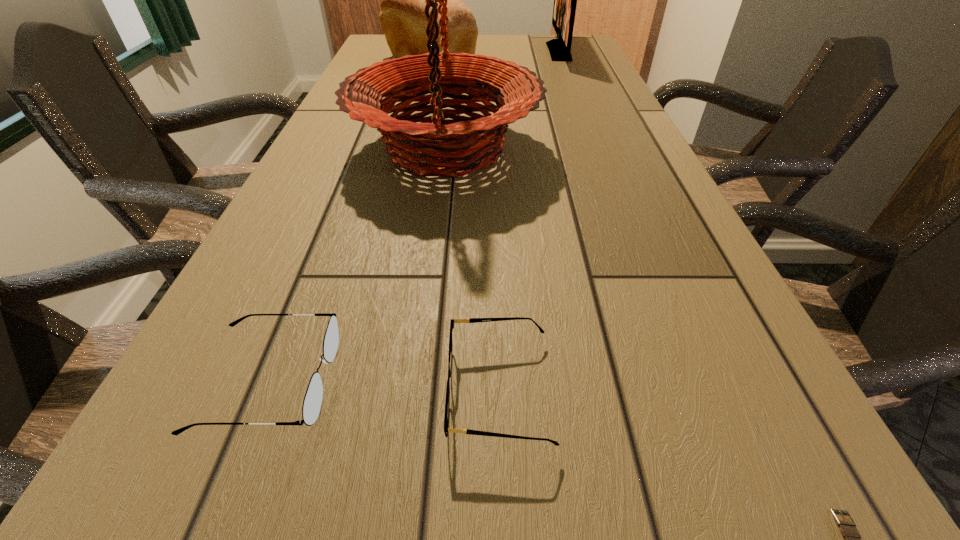
Image resolution: width=960 pixels, height=540 pixels. What are the coordinates of `free space located 0.070m on the front-facing side of the fifth shortest object` in the screenshot? It's located at (528, 52).

Where is `vacant space located on the right of the bread`? The height and width of the screenshot is (540, 960). vacant space located on the right of the bread is located at coordinates (603, 65).

Where is `vacant area situated 0.280m on the lenses of the left spectacles`? vacant area situated 0.280m on the lenses of the left spectacles is located at coordinates [551, 381].

Locate an element on the screen. Image resolution: width=960 pixels, height=540 pixels. vacant space located 0.200m on the front-facing side of the right spectacles is located at coordinates (288, 391).

The height and width of the screenshot is (540, 960). In order to click on blank space located on the front-facing side of the right spectacles in this screenshot , I will do `click(328, 391)`.

I want to click on free space located 0.210m on the front-facing side of the right spectacles, so click(280, 391).

Identify the location of monitor present at the far edge. (565, 0).

The width and height of the screenshot is (960, 540). Identify the location of bread present at the far edge. (402, 18).

Where is `basket that is at the left edge`? basket that is at the left edge is located at coordinates (413, 146).

Locate an element on the screen. bread situated at the left edge is located at coordinates (402, 18).